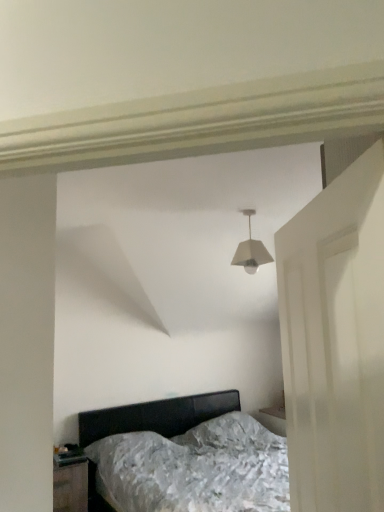
This screenshot has width=384, height=512. Describe the element at coordinates (70, 483) in the screenshot. I see `black glossy nightstand at lower left` at that location.

Where is `metallic silver bed at center`? metallic silver bed at center is located at coordinates (184, 457).

This screenshot has height=512, width=384. What do you see at coordinates (335, 341) in the screenshot?
I see `white matte door at right` at bounding box center [335, 341].

Find the location of a particular element. This screenshot has height=512, width=384. black glossy nightstand at lower left is located at coordinates (70, 483).

The height and width of the screenshot is (512, 384). I want to click on door above the black glossy nightstand at lower left (from the image's perspective), so click(x=335, y=341).

Is black glossy nightstand at lower left facing away from white matte door at right?

No, black glossy nightstand at lower left's orientation is not away from white matte door at right.

From a real-world perspective, who is located lower, black glossy nightstand at lower left or white matte door at right?

In real-world perspective, black glossy nightstand at lower left is lower.

Considering the sizes of objects black glossy nightstand at lower left and white matte lampshade at center in the image provided, who is bigger, black glossy nightstand at lower left or white matte lampshade at center?

Bigger between the two is black glossy nightstand at lower left.

Considering the positions of objects black glossy nightstand at lower left and white matte lampshade at center in the image provided, who is more to the left, black glossy nightstand at lower left or white matte lampshade at center?

From the viewer's perspective, black glossy nightstand at lower left appears more on the left side.

How many degrees apart are the facing directions of black glossy nightstand at lower left and white matte lampshade at center?

The facing directions of black glossy nightstand at lower left and white matte lampshade at center are 1.87 degrees apart.

From the image's perspective, would you say black glossy nightstand at lower left is positioned over white matte lampshade at center?

No, from the image's perspective, black glossy nightstand at lower left is not over white matte lampshade at center.

Can you tell me how much white matte door at right and metallic silver bed at center differ in facing direction?

white matte door at right and metallic silver bed at center are facing 121 degrees away from each other.

From a real-world perspective, between white matte door at right and metallic silver bed at center, who is vertically lower?

From a 3D spatial view, metallic silver bed at center is below.

Is white matte door at right behind metallic silver bed at center?

No, the depth of white matte door at right is less than that of metallic silver bed at center.

Consider the image. Considering the relative positions of white matte door at right and metallic silver bed at center in the image provided, is white matte door at right to the left of metallic silver bed at center from the viewer's perspective?

Indeed, white matte door at right is positioned on the left side of metallic silver bed at center.

Between white matte lampshade at center and black glossy nightstand at lower left, which one has smaller width?

Thinner between the two is white matte lampshade at center.

From the image's perspective, is white matte lampshade at center above black glossy nightstand at lower left?

Indeed, from the image's perspective, white matte lampshade at center is shown above black glossy nightstand at lower left.

This screenshot has height=512, width=384. In the image, there is a black glossy nightstand at lower left. Identify the location of lamp above it (from the image's perspective). (251, 250).

Between white matte lampshade at center and black glossy nightstand at lower left, which one has smaller size?

white matte lampshade at center.

Is white matte door at right not close to white matte lampshade at center?

white matte door at right is far away from white matte lampshade at center.

Measure the distance from white matte door at right to white matte lampshade at center.

A distance of 1.60 meters exists between white matte door at right and white matte lampshade at center.

From a real-world perspective, which object rests below the other?

white matte door at right is physically lower.

Based on their sizes in the image, would you say white matte door at right is bigger or smaller than white matte lampshade at center?

Clearly, white matte door at right is larger in size than white matte lampshade at center.

Is metallic silver bed at center directly adjacent to black glossy nightstand at lower left?

metallic silver bed at center and black glossy nightstand at lower left are clearly separated.

Looking at this image, is metallic silver bed at center oriented towards black glossy nightstand at lower left?

No, metallic silver bed at center is not facing towards black glossy nightstand at lower left.

Is metallic silver bed at center positioned in front of black glossy nightstand at lower left?

Yes, metallic silver bed at center is closer to the camera.

Does point (266, 263) lie in front of point (363, 218)?

No, it is behind (363, 218).

Would you say white matte lampshade at center is outside white matte door at right?

Yes, white matte lampshade at center is located beyond the bounds of white matte door at right.

From the picture: In the image, is white matte lampshade at center positioned in front of or behind white matte door at right?

Visually, white matte lampshade at center is located behind white matte door at right.

The height and width of the screenshot is (512, 384). Identify the location of nightstand located underneath the white matte door at right (from a real-world perspective). (70, 483).

The width and height of the screenshot is (384, 512). What are the coordinates of `nightstand below the white matte lampshade at center (from the image's perspective)` in the screenshot? It's located at (70, 483).

When comparing their distances from white matte lampshade at center, does white matte door at right or black glossy nightstand at lower left seem closer?

white matte door at right is closer to white matte lampshade at center.

Which object lies nearer to the anchor point white matte lampshade at center, white matte door at right or metallic silver bed at center?

The object closer to white matte lampshade at center is white matte door at right.

Based on their spatial positions, is white matte lampshade at center or white matte door at right further from metallic silver bed at center?

white matte door at right is positioned further to the anchor metallic silver bed at center.

Looking at the image, which one is located further to black glossy nightstand at lower left, metallic silver bed at center or white matte lampshade at center?

Among the two, white matte lampshade at center is located further to black glossy nightstand at lower left.

Based on their spatial positions, is metallic silver bed at center or white matte door at right further from white matte lampshade at center?

metallic silver bed at center.

When comparing their distances from black glossy nightstand at lower left, does white matte lampshade at center or white matte door at right seem further?

white matte door at right is further to black glossy nightstand at lower left.

Which object lies further to the anchor point white matte door at right, black glossy nightstand at lower left or white matte lampshade at center?

black glossy nightstand at lower left lies further to white matte door at right than the other object.

When comparing their distances from metallic silver bed at center, does white matte door at right or black glossy nightstand at lower left seem further?

The object further to metallic silver bed at center is white matte door at right.

Locate an element on the screen. This screenshot has width=384, height=512. lamp between white matte door at right and black glossy nightstand at lower left along the z-axis is located at coordinates (251, 250).

Locate an element on the screen. The height and width of the screenshot is (512, 384). bed located between white matte door at right and white matte lampshade at center in the depth direction is located at coordinates (184, 457).

Identify the location of bed positioned between white matte door at right and black glossy nightstand at lower left from near to far. This screenshot has width=384, height=512. (184, 457).

Locate an element on the screen. bed between white matte lampshade at center and black glossy nightstand at lower left vertically is located at coordinates (184, 457).